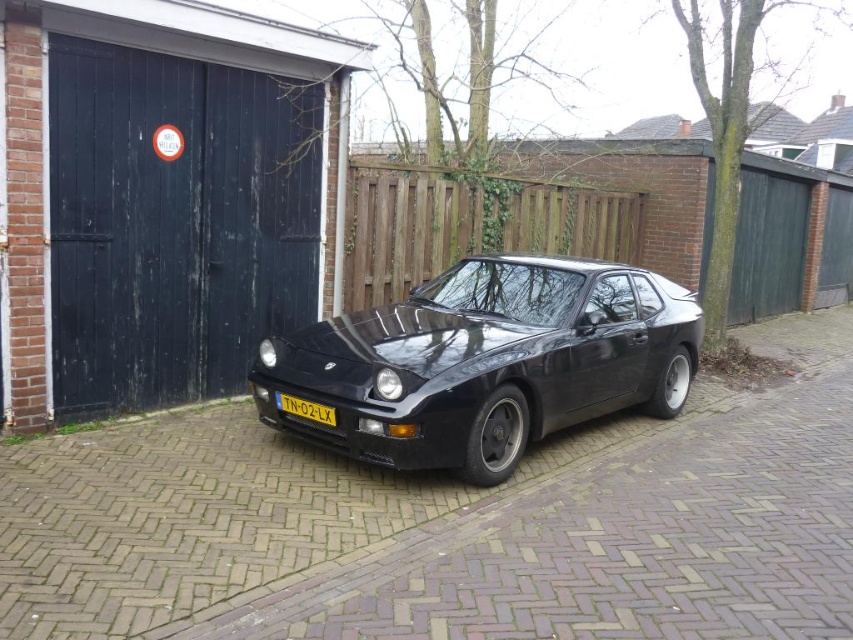
You are a delivery driver who needs to deliver a package to the owner of the glossy black car at center. The address provided has the license plate number TN02LX. Can you confirm if the yellow matte license plate at center matches the address?

The glossy black car at center has the yellow matte license plate at center with the number TN02LX, so yes, the license plate matches the address provided.